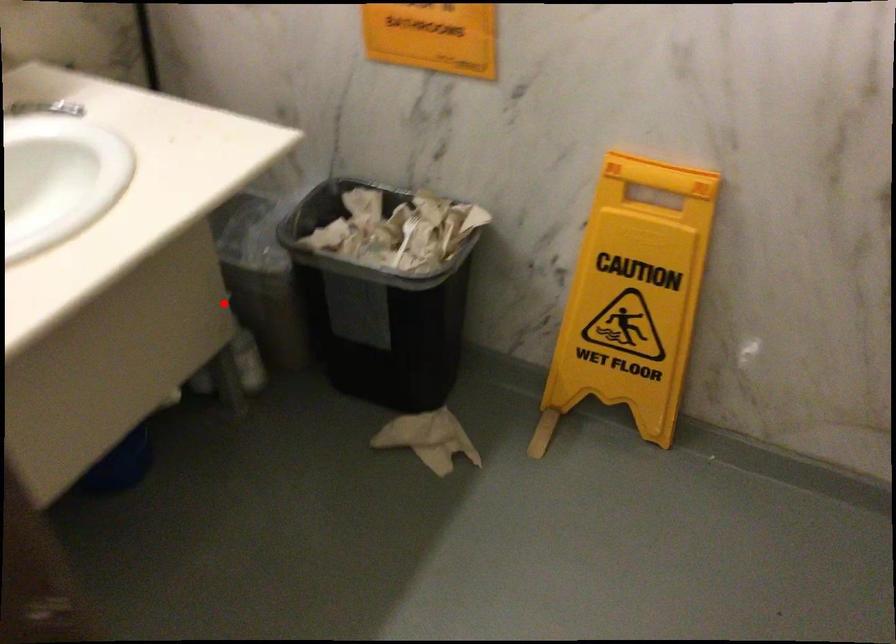
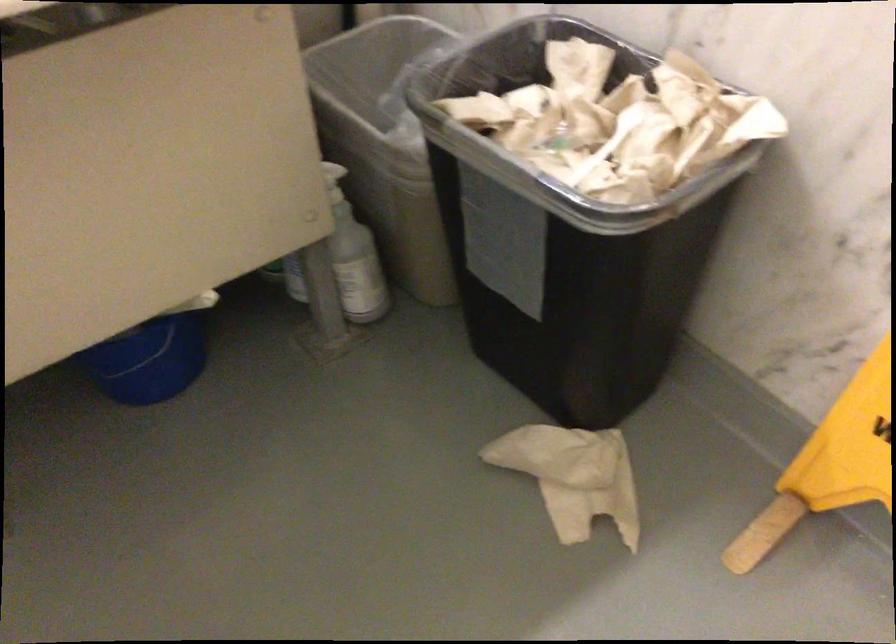
Where in the second image is the point corresponding to the highlighted location from the first image?

(333, 182)